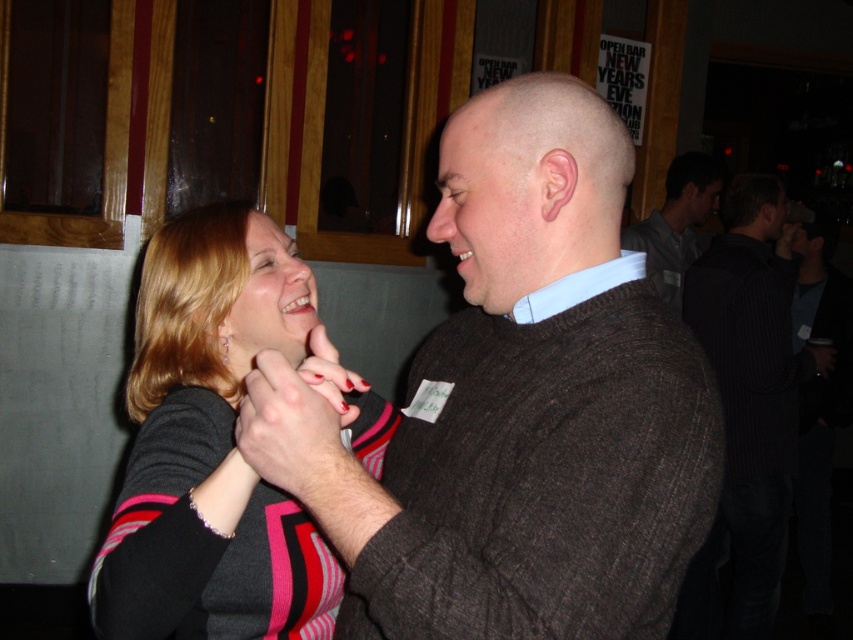
Question: Among these points, which one is farthest from the camera?

Choices:
 (A) (717, 310)
 (B) (631, 284)

Answer: (A)

Question: Which of the following is the farthest from the observer?

Choices:
 (A) striped sweater at center
 (B) black pinstripe sweater at right
 (C) dark gray sweater at center

Answer: (C)

Question: Which object is positioned farthest from the dark gray sweater at center?

Choices:
 (A) black pinstripe sweater at right
 (B) dark brown sweater at center
 (C) striped sweater at center

Answer: (B)

Question: Can you confirm if striped sweater at center is positioned below dark gray sweater at center?

Choices:
 (A) no
 (B) yes

Answer: (B)

Question: Can you confirm if black pinstripe sweater at right is wider than dark gray sweater at center?

Choices:
 (A) yes
 (B) no

Answer: (A)

Question: Is the position of dark brown sweater at center less distant than that of dark gray sweater at center?

Choices:
 (A) no
 (B) yes

Answer: (B)